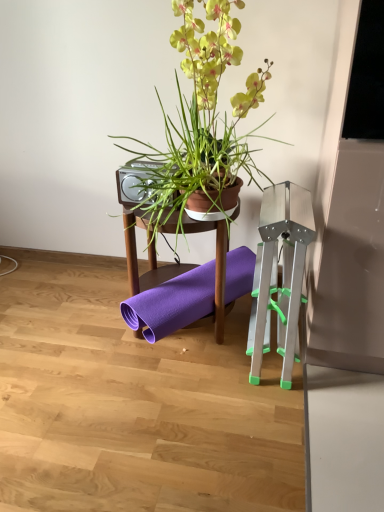
At what (x,y) coordinates should I click in order to perform the action: click on free space in front of purple rubber yoga mat at center. Please return your answer as a coordinate pair (x, y). The width and height of the screenshot is (384, 512). Looking at the image, I should click on click(175, 391).